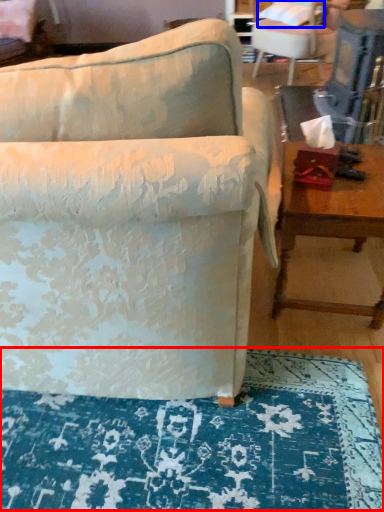
Question: Which object is further to the camera taking this photo, mat (highlighted by a red box) or pillow (highlighted by a blue box)?

Choices:
 (A) mat
 (B) pillow

Answer: (B)